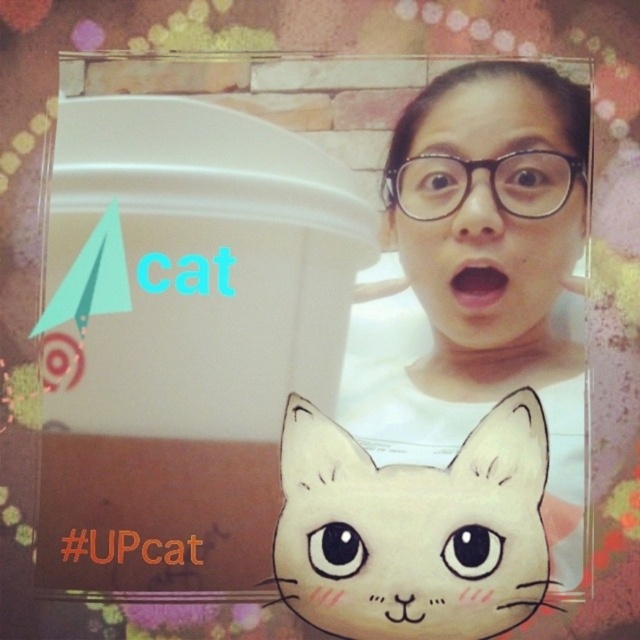
Does white matte face at center have a greater width compared to matte white cat face at center?

In fact, white matte face at center might be narrower than matte white cat face at center.

Between white matte face at center and matte white cat face at center, which one has less height?

Standing shorter between the two is matte white cat face at center.

Is point (492, 141) less distant than point (296, 403)?

That is True.

Where is `white matte face at center`? The image size is (640, 640). white matte face at center is located at coordinates (483, 275).

Is matte white cat face at center to the left of matte plastic face at upper center from the viewer's perspective?

Correct, you'll find matte white cat face at center to the left of matte plastic face at upper center.

Who is more distant from viewer, (499, 408) or (433, 131)?

Point (433, 131)

The image size is (640, 640). Find the location of `matte white cat face at center`. matte white cat face at center is located at coordinates (413, 529).

The height and width of the screenshot is (640, 640). Identify the location of matte white cat face at center. (413, 529).

Is white matte face at center shorter than matte plastic face at upper center?

No.

Can you confirm if white matte face at center is taller than matte plastic face at upper center?

Yes.

The image size is (640, 640). Describe the element at coordinates (483, 275) in the screenshot. I see `white matte face at center` at that location.

Where is `white matte face at center`? The height and width of the screenshot is (640, 640). white matte face at center is located at coordinates (483, 275).